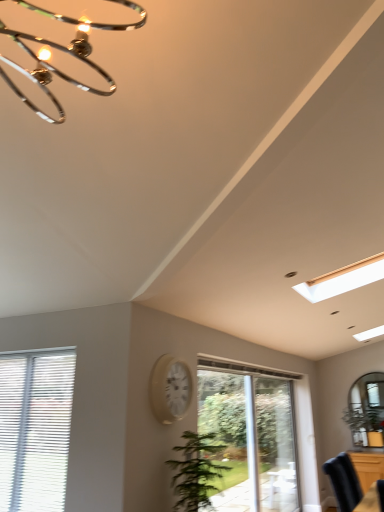
Where is `brown wooden dresser at lower right`? This screenshot has height=512, width=384. brown wooden dresser at lower right is located at coordinates (368, 467).

This screenshot has width=384, height=512. Describe the element at coordinates (276, 445) in the screenshot. I see `clear glass door at center` at that location.

The height and width of the screenshot is (512, 384). Describe the element at coordinates (170, 389) in the screenshot. I see `white glossy clock at center` at that location.

The image size is (384, 512). What are the coordinates of `white blinds at lower left, positioned as the second window in right-to-left order` in the screenshot? It's located at click(35, 428).

Find the location of `green leafy plant at center`. green leafy plant at center is located at coordinates (196, 472).

Is brown wooden dresser at lower right with white glossy clock at center?

No, brown wooden dresser at lower right is not in contact with white glossy clock at center.

From a real-world perspective, is brown wooden dresser at lower right below white glossy clock at center?

Yes, from a real-world perspective, brown wooden dresser at lower right is under white glossy clock at center.

I want to click on dresser that is behind the white glossy clock at center, so click(368, 467).

Considering the relative sizes of brown wooden dresser at lower right and white glossy clock at center in the image provided, is brown wooden dresser at lower right wider than white glossy clock at center?

Yes, brown wooden dresser at lower right is wider than white glossy clock at center.

Which object is thinner, clear glass door at center, the second window when ordered from front to back, or clear glass door at center?

clear glass door at center is thinner.

Is point (202, 381) less distant than point (273, 469)?

That is True.

Would you say clear glass door at center is part of clear glass door at center, acting as the 2th window starting from the left,'s contents?

No, clear glass door at center is not inside clear glass door at center, acting as the 2th window starting from the left.

Considering the relative positions of white glossy clock at center and clear glass door at center, the second window when ordered from front to back, in the image provided, is white glossy clock at center in front of clear glass door at center, the second window when ordered from front to back,?

Yes, it is.

Is white glossy clock at center at the right side of clear glass door at center, the second window when ordered from front to back?

No.

Considering the positions of points (169, 384) and (286, 381), is point (169, 384) closer to camera compared to point (286, 381)?

Yes, it is in front of point (286, 381).

From the image's perspective, is white glossy clock at center above or below clear glass door at center, marked as the 1th window in a right-to-left arrangement?

From the image's perspective, white glossy clock at center appears above clear glass door at center, marked as the 1th window in a right-to-left arrangement.

Is white blinds at lower left, arranged as the 1th window when viewed from the left, far from white glossy clock at center?

No, white blinds at lower left, arranged as the 1th window when viewed from the left, is in close proximity to white glossy clock at center.

From the image's perspective, is white blinds at lower left, acting as the 1th window starting from the front, beneath white glossy clock at center?

Correct, white blinds at lower left, acting as the 1th window starting from the front, appears lower than white glossy clock at center in the image.

Who is more distant, white blinds at lower left, positioned as the second window in right-to-left order, or white glossy clock at center?

white blinds at lower left, positioned as the second window in right-to-left order, is further away from the camera.

Based on the photo, considering the relative positions of white blinds at lower left, positioned as the second window in right-to-left order, and white glossy clock at center in the image provided, is white blinds at lower left, positioned as the second window in right-to-left order, to the left of white glossy clock at center from the viewer's perspective?

Indeed, white blinds at lower left, positioned as the second window in right-to-left order, is positioned on the left side of white glossy clock at center.

Is clear glass door at center completely or partially outside of brown wooden dresser at lower right?

Indeed, clear glass door at center is completely outside brown wooden dresser at lower right.

Would you consider clear glass door at center to be distant from brown wooden dresser at lower right?

No, clear glass door at center is not far away from brown wooden dresser at lower right.

Considering the sizes of objects clear glass door at center and brown wooden dresser at lower right in the image provided, who is taller, clear glass door at center or brown wooden dresser at lower right?

clear glass door at center.

Where is `screen door on the left of brown wooden dresser at lower right`? screen door on the left of brown wooden dresser at lower right is located at coordinates (276, 445).

How many degrees apart are the facing directions of clear glass door at center and white blinds at lower left, positioned as the second window in right-to-left order?

90 degrees separate the facing orientations of clear glass door at center and white blinds at lower left, positioned as the second window in right-to-left order.

Is clear glass door at center positioned beyond the bounds of white blinds at lower left, arranged as the 1th window when viewed from the left?

That's correct, clear glass door at center is outside of white blinds at lower left, arranged as the 1th window when viewed from the left.

Does clear glass door at center come in front of white blinds at lower left, positioned as the second window in right-to-left order?

No, clear glass door at center is behind white blinds at lower left, positioned as the second window in right-to-left order.

Between clear glass door at center and white blinds at lower left, acting as the 1th window starting from the front, which one appears on the left side from the viewer's perspective?

white blinds at lower left, acting as the 1th window starting from the front, is more to the left.

Visually, is brown wooden dresser at lower right positioned to the left or to the right of clear glass door at center?

Clearly, brown wooden dresser at lower right is on the right of clear glass door at center in the image.

Is brown wooden dresser at lower right positioned with its back to clear glass door at center?

brown wooden dresser at lower right does not have its back to clear glass door at center.

Is brown wooden dresser at lower right surrounding clear glass door at center?

No, clear glass door at center is not inside brown wooden dresser at lower right.

Who is more distant, brown wooden dresser at lower right or clear glass door at center?

brown wooden dresser at lower right.

Identify the location of dresser behind the white glossy clock at center. (368, 467).

From a real-world perspective, count 1st windows upward from the clear glass door at center and point to it. Please provide its 2D coordinates.

[(252, 431)]

Estimate the real-world distances between objects in this image. Which object is further from white blinds at lower left, acting as the 1th window starting from the front, brown wooden dresser at lower right or clear glass door at center?

brown wooden dresser at lower right is further to white blinds at lower left, acting as the 1th window starting from the front.

Estimate the real-world distances between objects in this image. Which object is further from green leafy plant at center, clear glass door at center or clear glass door at center, acting as the 2th window starting from the left?

Based on the image, clear glass door at center appears to be further to green leafy plant at center.

Looking at the image, which one is located closer to brown wooden dresser at lower right, clear glass door at center or white glossy clock at center?

clear glass door at center is positioned closer to the anchor brown wooden dresser at lower right.

Considering their positions, is clear glass door at center, marked as the 1th window in a right-to-left arrangement, positioned further to brown wooden dresser at lower right than green leafy plant at center?

green leafy plant at center lies further to brown wooden dresser at lower right than the other object.

Looking at this image, based on their spatial positions, is green leafy plant at center or white blinds at lower left, marked as the second window in a back-to-front arrangement, further from white glossy clock at center?

Among the two, white blinds at lower left, marked as the second window in a back-to-front arrangement, is located further to white glossy clock at center.

Based on their spatial positions, is green leafy plant at center or white blinds at lower left, positioned as the second window in right-to-left order, closer to clear glass door at center, marked as the 1th window in a right-to-left arrangement?

Among the two, green leafy plant at center is located nearer to clear glass door at center, marked as the 1th window in a right-to-left arrangement.

Which object lies nearer to the anchor point green leafy plant at center, brown wooden dresser at lower right or white blinds at lower left, acting as the 1th window starting from the front?

white blinds at lower left, acting as the 1th window starting from the front.

Based on their spatial positions, is brown wooden dresser at lower right or clear glass door at center, the second window when ordered from front to back, closer to clear glass door at center?

clear glass door at center, the second window when ordered from front to back.

Locate an element on the screen. The image size is (384, 512). clock between green leafy plant at center and clear glass door at center along the z-axis is located at coordinates pos(170,389).

This screenshot has width=384, height=512. I want to click on screen door located between white blinds at lower left, acting as the 1th window starting from the front, and brown wooden dresser at lower right in the left-right direction, so click(x=276, y=445).

Find the location of a particular element. The height and width of the screenshot is (512, 384). houseplant between white blinds at lower left, arranged as the 1th window when viewed from the left, and clear glass door at center from left to right is located at coordinates (196, 472).

The image size is (384, 512). What are the coordinates of `clock between white blinds at lower left, arranged as the 1th window when viewed from the left, and brown wooden dresser at lower right, in the horizontal direction` in the screenshot? It's located at coord(170,389).